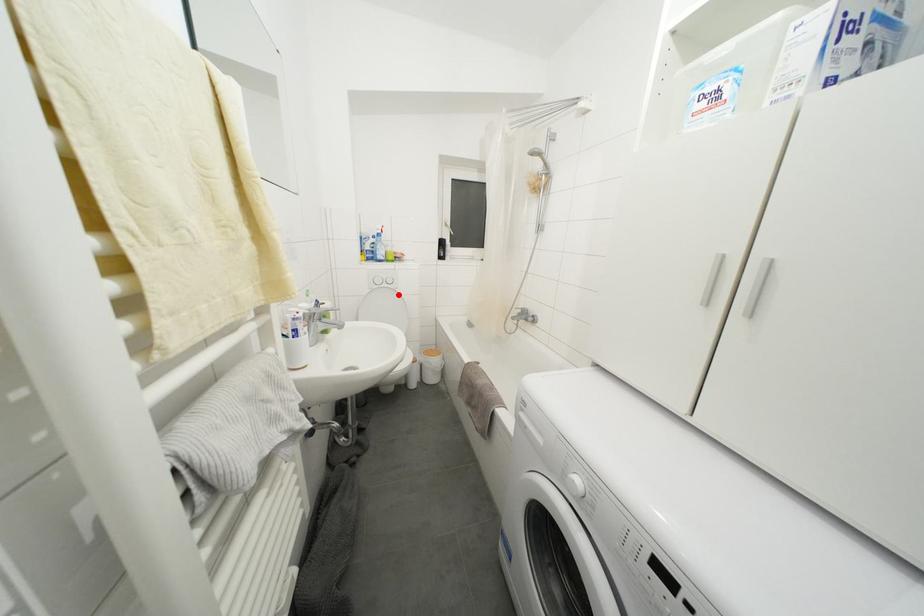
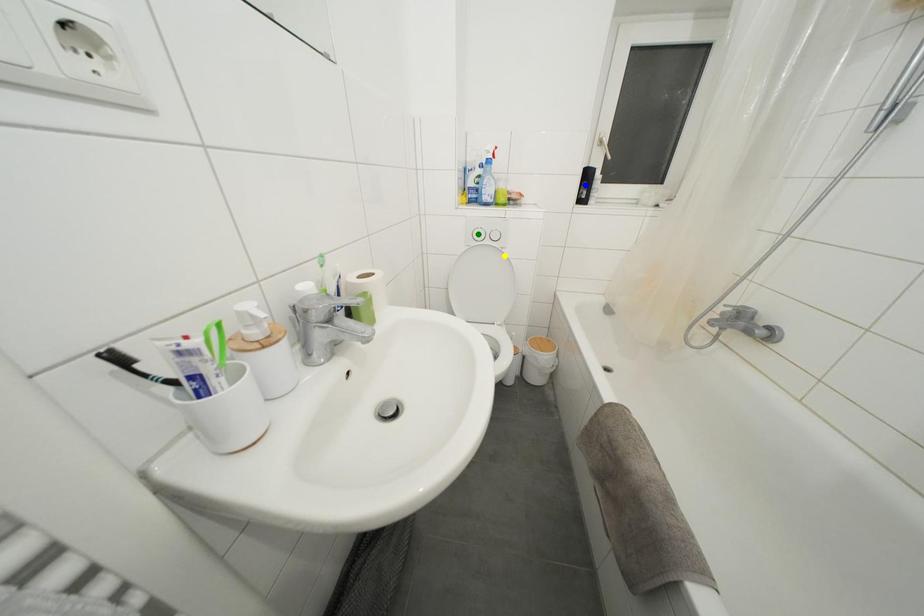
Question: I am providing you with two images of the same scene from different viewpoints. A red point is marked on the first image. You are given multiple points on the second image. Which point in image 2 represents the same 3d spot as the red point in image 1?

Choices:
 (A) yellow point
 (B) blue point
 (C) green point

Answer: (A)